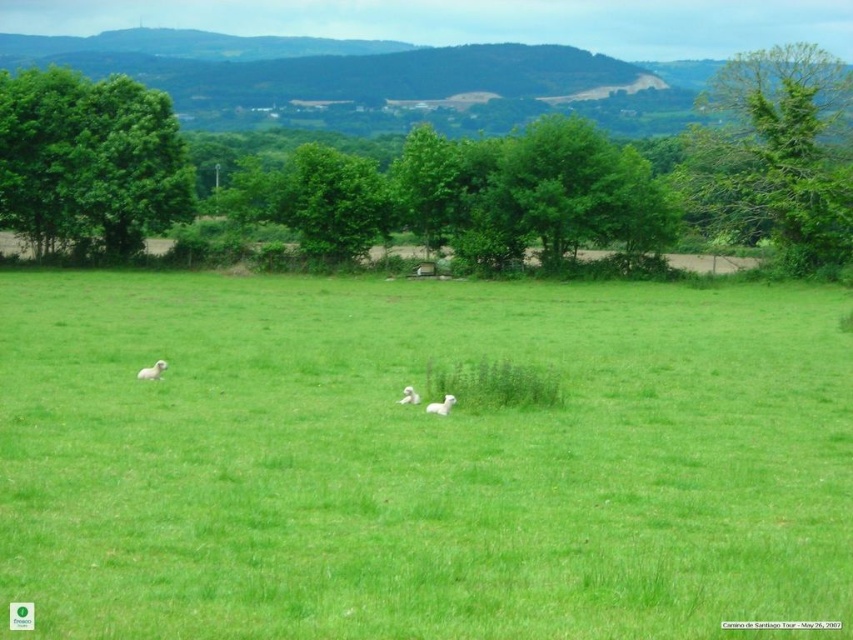
You are standing in the rural landscape and want to place a small flag at each of the two points marked in the image. The first point is at coordinates point (146, 369) and the second at point (410, 397). Which point is closer to you where you are standing?

Point (146, 369) is closer to you because it is further to the viewer than point (410, 397).